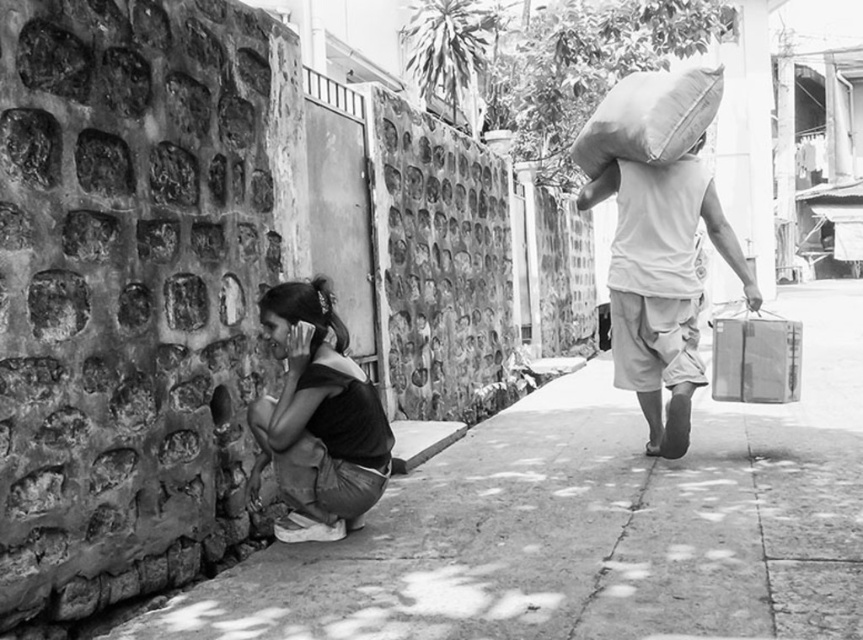
You are a delivery person who needs to retrieve both the textured brown sack at upper right and the metallic gray suitcase at right. Which object should you reach for first if you want to pick up the one that is higher up?

The textured brown sack at upper right is located above the metallic gray suitcase at right, so you should reach for the textured brown sack at upper right first.

You are standing in the street scene and want to place a small potted plant on the smooth concrete pavement at lower left. However, there is a matte white shirt at right in the way. Can you place the plant there without the shirt blocking it?

The smooth concrete pavement at lower left is closer to the viewer than the matte white shirt at right, so the plant can be placed there without obstruction from the shirt.